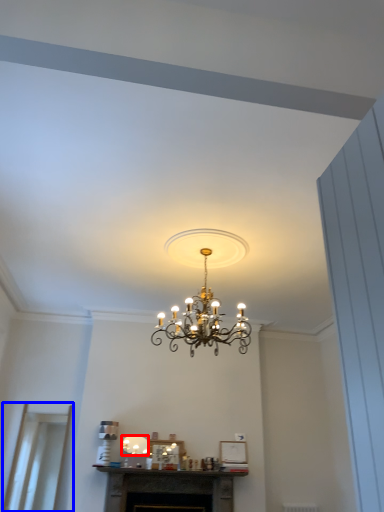
Question: Which of the following is the closest to the observer, lamp (highlighted by a red box) or glass door (highlighted by a blue box)?

Choices:
 (A) lamp
 (B) glass door

Answer: (B)